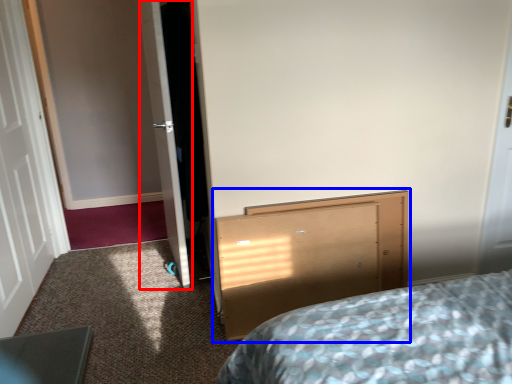
Question: Which object appears farthest to the camera in this image, door (highlighted by a red box) or vanity (highlighted by a blue box)?

Choices:
 (A) door
 (B) vanity

Answer: (A)